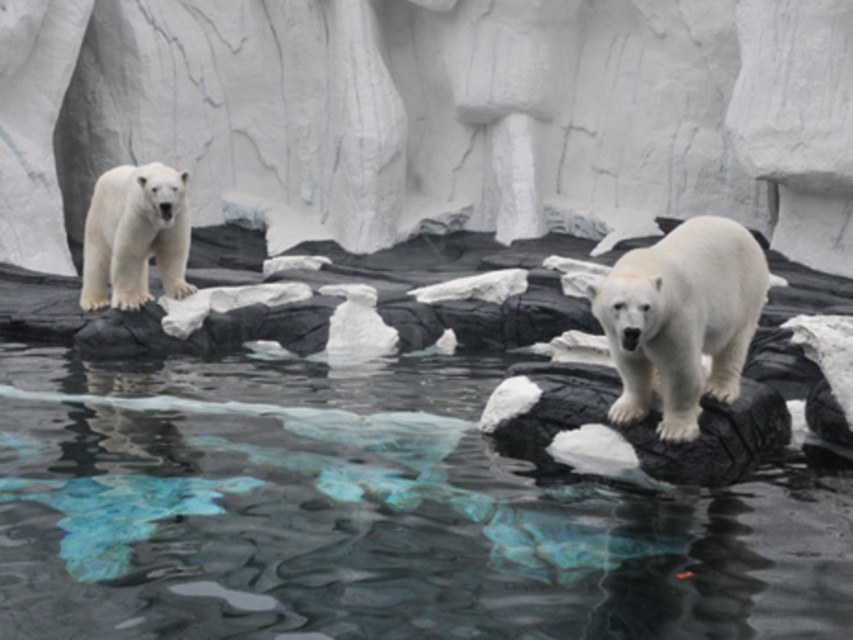
You are a zookeeper planning to place a floating platform for the polar bears. The platform requires a space larger than the clear glass water at center. Based on the scene, is the white ice at upper center a suitable location?

The clear glass water at center has a smaller size compared to white ice at upper center. Since the platform needs a space larger than the clear glass water at center, the white ice at upper center is suitable because it is larger in size.

You are a zookeeper observing the polar bears in their enclosure. You notice a point marked at coordinates (433, 115). What does this point correspond to in the enclosure?

The point at (433, 115) corresponds to the white ice at upper center in the enclosure.

From the picture: You are a zookeeper who needs to place a new feeding station between the white rubber tire at center and the white fur polar bear at upper left. Since the tire is smaller, where should you position the feeding station so it doesn

The white rubber tire at center is smaller than the white fur polar bear at upper left. To place the feeding station between them, position it closer to the tire to ensure it doesn